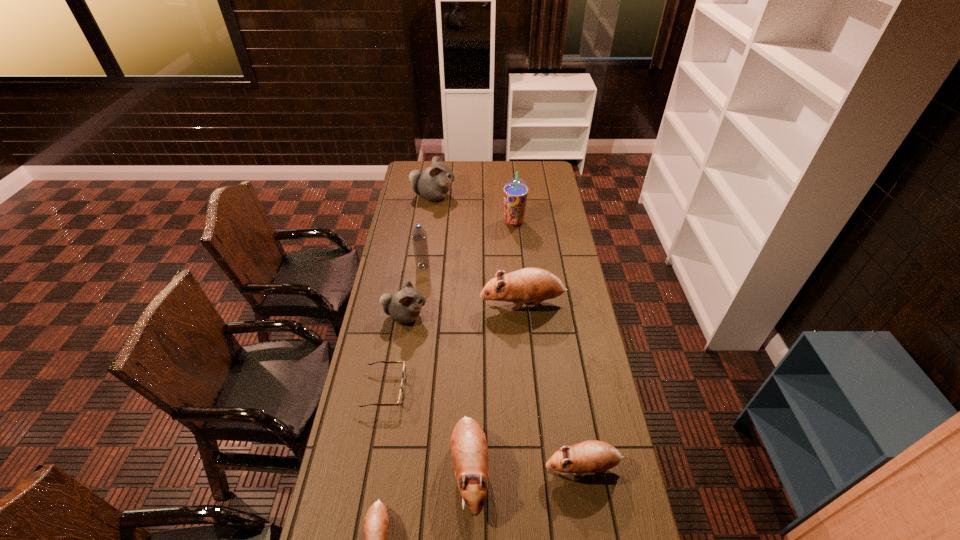
Find the location of a particular element. free space that is in between the second shortest hamster and the blue water bottle is located at coordinates (503, 366).

Locate an element on the screen. free spot between the spectacles and the seventh nearest object is located at coordinates (404, 328).

Locate an element on the screen. The image size is (960, 540). vacant space in between the spectacles and the nearer white hamster is located at coordinates (396, 353).

Where is `free space that is in between the spectacles and the water bottle`? The image size is (960, 540). free space that is in between the spectacles and the water bottle is located at coordinates (404, 328).

I want to click on vacant region between the farthest brown hamster and the nearer white hamster, so click(464, 310).

Where is `unoccupied position between the bigger white hamster and the blue water bottle`? Image resolution: width=960 pixels, height=540 pixels. unoccupied position between the bigger white hamster and the blue water bottle is located at coordinates (428, 231).

Where is `object that stands as the sixth closest to the farthest brown hamster`? This screenshot has height=540, width=960. object that stands as the sixth closest to the farthest brown hamster is located at coordinates (591, 456).

This screenshot has width=960, height=540. Find the location of `object identified as the sixth closest to the eighth tallest object`. object identified as the sixth closest to the eighth tallest object is located at coordinates (419, 237).

This screenshot has height=540, width=960. Find the location of `hamster that is the fourth nearest to the smaller white hamster`. hamster that is the fourth nearest to the smaller white hamster is located at coordinates (376, 523).

Locate an element on the screen. The image size is (960, 540). hamster that is the fourth closest to the seventh nearest object is located at coordinates coord(469,452).